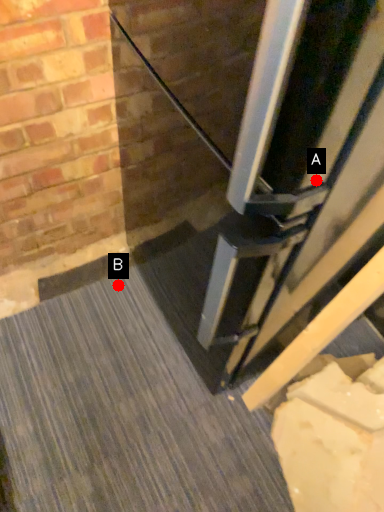
Question: Two points are circled on the image, labeled by A and B beside each circle. Which point is farther to the camera?

Choices:
 (A) A is further
 (B) B is further

Answer: (B)